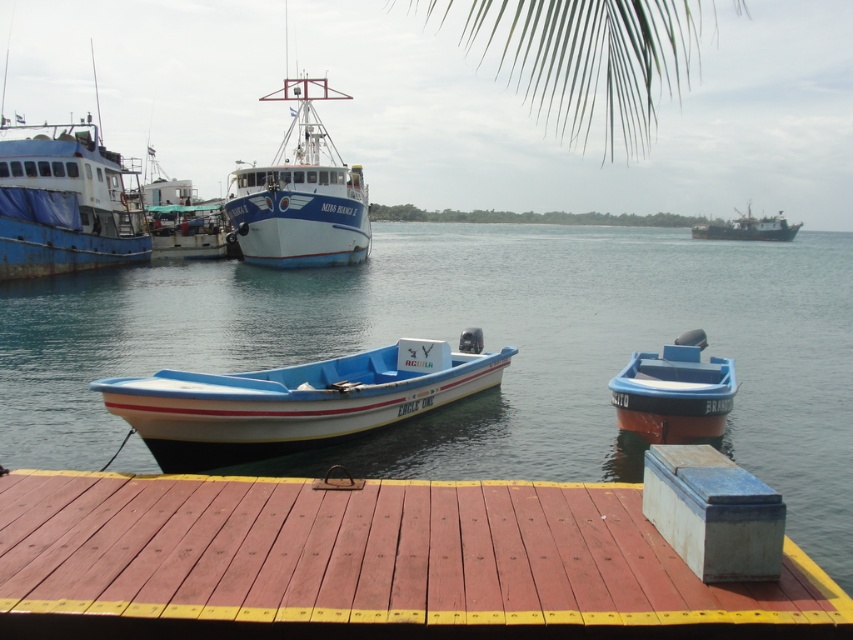
Between wooden dock at center and green leafy palm at upper center, which one is positioned lower?

wooden dock at center

Find the location of `wooden dock at center`. wooden dock at center is located at coordinates (369, 563).

Image resolution: width=853 pixels, height=640 pixels. In order to click on wooden dock at center in this screenshot , I will do `click(369, 563)`.

The height and width of the screenshot is (640, 853). Identify the location of white plastic boat at center. (294, 401).

Is the position of white plastic boat at center less distant than that of white matte ship at upper right?

Yes, it is in front of white matte ship at upper right.

Between point (225, 449) and point (767, 218), which one is positioned behind?

The point (767, 218) is behind.

Identify the location of white plastic boat at center. (294, 401).

Who is lower down, green leafy palm at upper center or blue plastic boat at right?

blue plastic boat at right is lower down.

Can you confirm if green leafy palm at upper center is wider than blue plastic boat at right?

Indeed, green leafy palm at upper center has a greater width compared to blue plastic boat at right.

Who is more forward, (648, 32) or (618, 394)?

Positioned in front is point (648, 32).

At what (x,y) coordinates should I click in order to perform the action: click on green leafy palm at upper center. Please return your answer as a coordinate pair (x, y). Looking at the image, I should click on click(x=587, y=60).